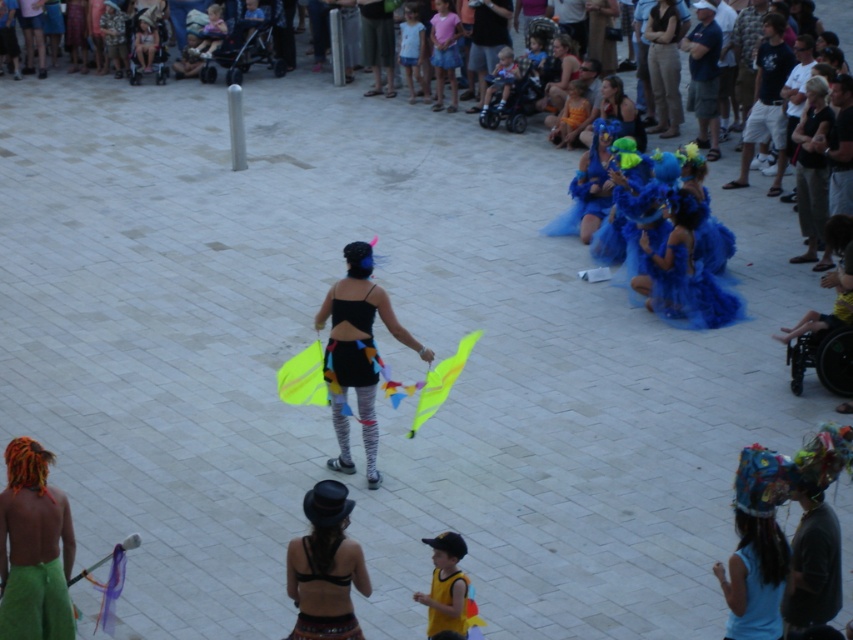
Between point (782, 497) and point (775, 38), which one is positioned behind?

Point (775, 38)

Can you confirm if blue fabric headdress at center is positioned above dark blue t-shirt at right?

Incorrect, blue fabric headdress at center is not positioned above dark blue t-shirt at right.

This screenshot has height=640, width=853. What do you see at coordinates (757, 545) in the screenshot? I see `blue fabric headdress at center` at bounding box center [757, 545].

Identify the location of blue fabric headdress at center. Image resolution: width=853 pixels, height=640 pixels. (757, 545).

Between point (65, 577) and point (668, 310), which one is positioned behind?

Point (668, 310)

Who is more forward, (56, 509) or (682, 208)?

Point (56, 509) is in front.

This screenshot has width=853, height=640. I want to click on green fabric at lower left, so 33,547.

Locate an element on the screen. This screenshot has width=853, height=640. green fabric at lower left is located at coordinates (33, 547).

Based on the photo, who is positioned more to the left, dark blue t-shirt at right or shiny blue dress at center?

From the viewer's perspective, shiny blue dress at center appears more on the left side.

Is dark blue t-shirt at right smaller than shiny blue dress at center?

Yes.

At what (x,y) coordinates should I click in order to perform the action: click on dark blue t-shirt at right. Please return your answer as a coordinate pair (x, y). This screenshot has height=640, width=853. Looking at the image, I should click on (766, 100).

The width and height of the screenshot is (853, 640). What are the coordinates of `dark blue t-shirt at right` in the screenshot? It's located at (766, 100).